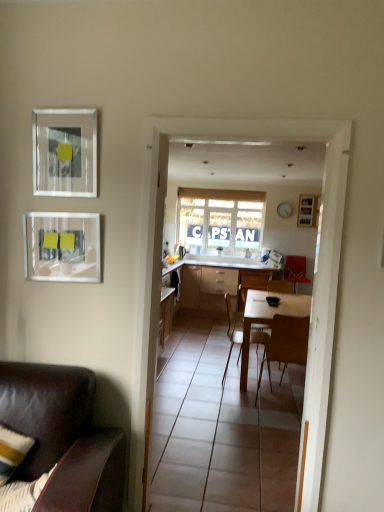
Question: From the image's perspective, is matte glass picture frame at upper left, the first picture frame in the left-to-right sequence, above or below white glossy table at center?

Choices:
 (A) below
 (B) above

Answer: (B)

Question: Is matte glass picture frame at upper left, which ranks as the first picture frame in bottom-to-top order, situated inside white glossy table at center or outside?

Choices:
 (A) outside
 (B) inside

Answer: (A)

Question: Which is nearer to the white glossy table at center?

Choices:
 (A) velvet red chair at right, arranged as the 5th chair when viewed from the left
 (B) transparent glass door at center
 (C) wooden chair at center, which is the third chair from back to front
 (D) brown wooden chair at center, which is the second chair from front to back
 (E) wooden chair at center, the 2th chair from the back

Answer: (E)

Question: Which of these objects is positioned farthest from the wooden picture frame at upper right, which is the 3th picture frame in bottom-to-top order?

Choices:
 (A) wooden chair at center, which is the fourth chair from right to left
 (B) brown leather chair at lower left, the fifth chair viewed from the right
 (C) matte glass picture frame at upper left, which ranks as the first picture frame in bottom-to-top order
 (D) brown wooden chair at center, which is counted as the second chair, starting from the right
 (E) matte glass picture frame at upper left, which ranks as the first picture frame in front-to-back order

Answer: (B)